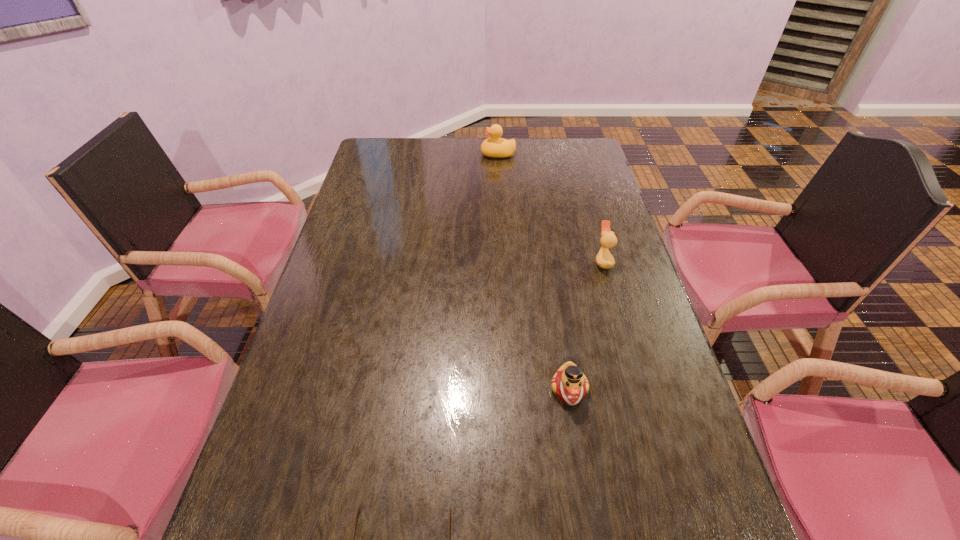
Locate an element on the screen. The image size is (960, 540). the leftmost duck is located at coordinates (496, 147).

You are a GUI agent. You are given a task and a screenshot of the screen. Output one action in this format:
    pyautogui.click(x=<x>, y=<y>)
    Task: Click on the farthest duck
    Image resolution: width=960 pixels, height=540 pixels.
    Given the screenshot: What is the action you would take?
    pyautogui.click(x=496, y=147)

In order to click on the rightmost object in this screenshot , I will do `click(604, 259)`.

This screenshot has width=960, height=540. Find the location of `the rightmost duck`. the rightmost duck is located at coordinates (604, 259).

Where is `the shortest duck`? This screenshot has width=960, height=540. the shortest duck is located at coordinates (569, 383).

Identify the location of the second shortest object. The height and width of the screenshot is (540, 960). (569, 383).

Locate an element on the screen. The image size is (960, 540). free location located 0.060m on the face of the leftmost duck is located at coordinates (466, 154).

Find the location of a particular element. vacant region located 0.320m on the face of the leftmost duck is located at coordinates (399, 154).

Where is `vacant space located on the face of the leftmost duck`? This screenshot has width=960, height=540. vacant space located on the face of the leftmost duck is located at coordinates (410, 154).

This screenshot has height=540, width=960. Find the location of `vacant region located 0.110m on the beak of the rightmost object`. vacant region located 0.110m on the beak of the rightmost object is located at coordinates (557, 261).